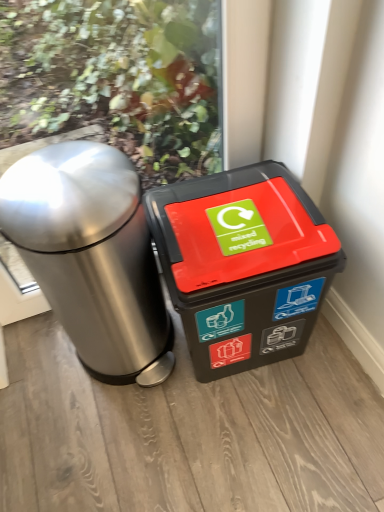
Describe the element at coordinates (243, 265) in the screenshot. I see `black plastic recycling bin at center, marked as the first waste container in a right-to-left arrangement` at that location.

At what (x,y) coordinates should I click in order to perform the action: click on black plastic recycling bin at center, the 2th waste container positioned from the left. Please return your answer as a coordinate pair (x, y). This screenshot has width=384, height=512. Looking at the image, I should click on (243, 265).

Measure the distance between brushed metal trash can at left, which is the second waste container in right-to-left order, and camera.

They are 76.90 centimeters apart.

This screenshot has width=384, height=512. Describe the element at coordinates (91, 256) in the screenshot. I see `brushed metal trash can at left, acting as the 1th waste container starting from the left` at that location.

What are the coordinates of `brushed metal trash can at left, acting as the 1th waste container starting from the left` in the screenshot? It's located at (91, 256).

Image resolution: width=384 pixels, height=512 pixels. Find the location of `black plastic recycling bin at center, marked as the first waste container in a right-to-left arrangement`. black plastic recycling bin at center, marked as the first waste container in a right-to-left arrangement is located at coordinates (243, 265).

Does brushed metal trash can at left, which is the second waste container in right-to-left order, appear on the right side of black plastic recycling bin at center, the 2th waste container positioned from the left?

No.

Between brushed metal trash can at left, which is the second waste container in right-to-left order, and black plastic recycling bin at center, marked as the first waste container in a right-to-left arrangement, which one is positioned behind?

Positioned behind is black plastic recycling bin at center, marked as the first waste container in a right-to-left arrangement.

Does point (98, 158) appear closer or farther from the camera than point (339, 247)?

Point (98, 158) is positioned closer to the camera compared to point (339, 247).

From the image's perspective, relative to black plastic recycling bin at center, marked as the first waste container in a right-to-left arrangement, is brushed metal trash can at left, acting as the 1th waste container starting from the left, above or below?

From the image's perspective, brushed metal trash can at left, acting as the 1th waste container starting from the left, appears above black plastic recycling bin at center, marked as the first waste container in a right-to-left arrangement.

From a real-world perspective, which object rests below the other?

In real-world perspective, black plastic recycling bin at center, the 2th waste container positioned from the left, is lower.

Which object is thinner, brushed metal trash can at left, acting as the 1th waste container starting from the left, or black plastic recycling bin at center, the 2th waste container positioned from the left?

Thinner between the two is black plastic recycling bin at center, the 2th waste container positioned from the left.

Between brushed metal trash can at left, which is the second waste container in right-to-left order, and black plastic recycling bin at center, marked as the first waste container in a right-to-left arrangement, which one has less height?

black plastic recycling bin at center, marked as the first waste container in a right-to-left arrangement.

Based on the photo, can you confirm if brushed metal trash can at left, which is the second waste container in right-to-left order, is smaller than black plastic recycling bin at center, the 2th waste container positioned from the left?

No, brushed metal trash can at left, which is the second waste container in right-to-left order, is not smaller than black plastic recycling bin at center, the 2th waste container positioned from the left.

Is brushed metal trash can at left, which is the second waste container in right-to-left order, positioned beyond the bounds of black plastic recycling bin at center, marked as the first waste container in a right-to-left arrangement?

That's correct, brushed metal trash can at left, which is the second waste container in right-to-left order, is outside of black plastic recycling bin at center, marked as the first waste container in a right-to-left arrangement.

Based on the photo, is brushed metal trash can at left, acting as the 1th waste container starting from the left, touching black plastic recycling bin at center, the 2th waste container positioned from the left?

brushed metal trash can at left, acting as the 1th waste container starting from the left, and black plastic recycling bin at center, the 2th waste container positioned from the left, are not in contact.

Is brushed metal trash can at left, which is the second waste container in right-to-left order, facing away from black plastic recycling bin at center, the 2th waste container positioned from the left?

No, brushed metal trash can at left, which is the second waste container in right-to-left order, is not facing away from black plastic recycling bin at center, the 2th waste container positioned from the left.

Based on the photo, how many degrees apart are the facing directions of brushed metal trash can at left, which is the second waste container in right-to-left order, and black plastic recycling bin at center, the 2th waste container positioned from the left?

5.18 degrees separate the facing orientations of brushed metal trash can at left, which is the second waste container in right-to-left order, and black plastic recycling bin at center, the 2th waste container positioned from the left.

Locate an element on the screen. The image size is (384, 512). waste container on the left of black plastic recycling bin at center, marked as the first waste container in a right-to-left arrangement is located at coordinates (91, 256).

Considering the relative positions of black plastic recycling bin at center, the 2th waste container positioned from the left, and brushed metal trash can at left, which is the second waste container in right-to-left order, in the image provided, is black plastic recycling bin at center, the 2th waste container positioned from the left, to the right of brushed metal trash can at left, which is the second waste container in right-to-left order, from the viewer's perspective?

Correct, you'll find black plastic recycling bin at center, the 2th waste container positioned from the left, to the right of brushed metal trash can at left, which is the second waste container in right-to-left order.

Is the position of black plastic recycling bin at center, marked as the first waste container in a right-to-left arrangement, less distant than that of brushed metal trash can at left, acting as the 1th waste container starting from the left?

No, it is not.

Which is closer to the camera, (x=263, y=303) or (x=37, y=239)?

Point (x=263, y=303) appears to be farther away from the viewer than point (x=37, y=239).

From the image's perspective, who appears lower, black plastic recycling bin at center, marked as the first waste container in a right-to-left arrangement, or brushed metal trash can at left, acting as the 1th waste container starting from the left?

From the image's view, black plastic recycling bin at center, marked as the first waste container in a right-to-left arrangement, is below.

From a real-world perspective, is black plastic recycling bin at center, the 2th waste container positioned from the left, physically located above or below brushed metal trash can at left, acting as the 1th waste container starting from the left?

From a real-world perspective, black plastic recycling bin at center, the 2th waste container positioned from the left, is physically below brushed metal trash can at left, acting as the 1th waste container starting from the left.

Consider the image. In terms of width, does black plastic recycling bin at center, marked as the first waste container in a right-to-left arrangement, look wider or thinner when compared to brushed metal trash can at left, acting as the 1th waste container starting from the left?

In the image, black plastic recycling bin at center, marked as the first waste container in a right-to-left arrangement, appears to be more narrow than brushed metal trash can at left, acting as the 1th waste container starting from the left.

Between black plastic recycling bin at center, marked as the first waste container in a right-to-left arrangement, and brushed metal trash can at left, which is the second waste container in right-to-left order, which one has less height?

With less height is black plastic recycling bin at center, marked as the first waste container in a right-to-left arrangement.

Between black plastic recycling bin at center, the 2th waste container positioned from the left, and brushed metal trash can at left, acting as the 1th waste container starting from the left, which one has larger size?

With larger size is brushed metal trash can at left, acting as the 1th waste container starting from the left.

Could brushed metal trash can at left, which is the second waste container in right-to-left order, be considered to be inside black plastic recycling bin at center, the 2th waste container positioned from the left?

Actually, brushed metal trash can at left, which is the second waste container in right-to-left order, is outside black plastic recycling bin at center, the 2th waste container positioned from the left.

Is the surface of black plastic recycling bin at center, the 2th waste container positioned from the left, in direct contact with brushed metal trash can at left, which is the second waste container in right-to-left order?

No, black plastic recycling bin at center, the 2th waste container positioned from the left, is not touching brushed metal trash can at left, which is the second waste container in right-to-left order.

Is black plastic recycling bin at center, marked as the first waste container in a right-to-left arrangement, turned away from brushed metal trash can at left, acting as the 1th waste container starting from the left?

That's not correct — black plastic recycling bin at center, marked as the first waste container in a right-to-left arrangement, is not looking away from brushed metal trash can at left, acting as the 1th waste container starting from the left.

At what (x,y) coordinates should I click in order to perform the action: click on waste container to the left of black plastic recycling bin at center, marked as the first waste container in a right-to-left arrangement. Please return your answer as a coordinate pair (x, y). This screenshot has height=512, width=384. Looking at the image, I should click on (91, 256).

Identify the location of waste container behind the brushed metal trash can at left, which is the second waste container in right-to-left order. (243, 265).

Image resolution: width=384 pixels, height=512 pixels. I want to click on waste container directly beneath the brushed metal trash can at left, acting as the 1th waste container starting from the left (from a real-world perspective), so click(x=243, y=265).